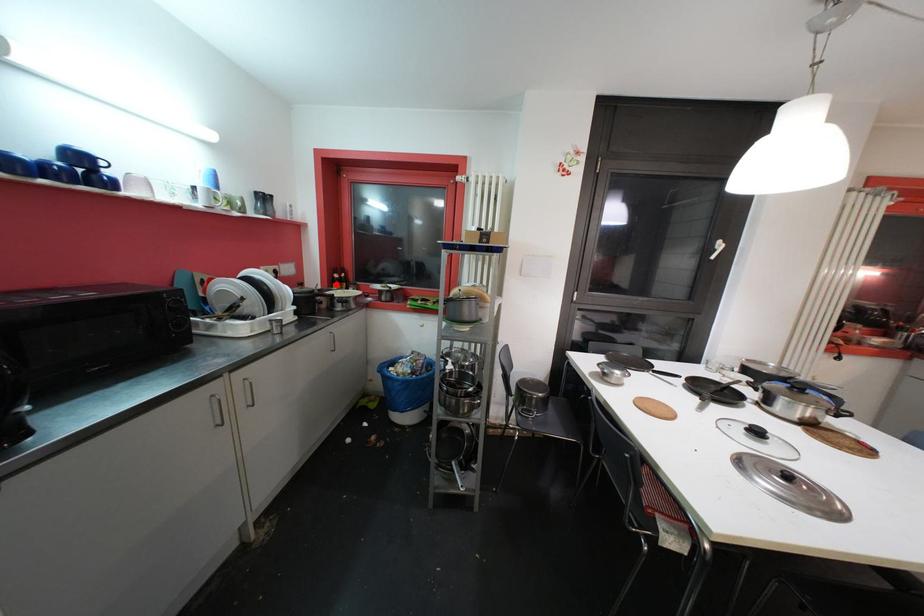
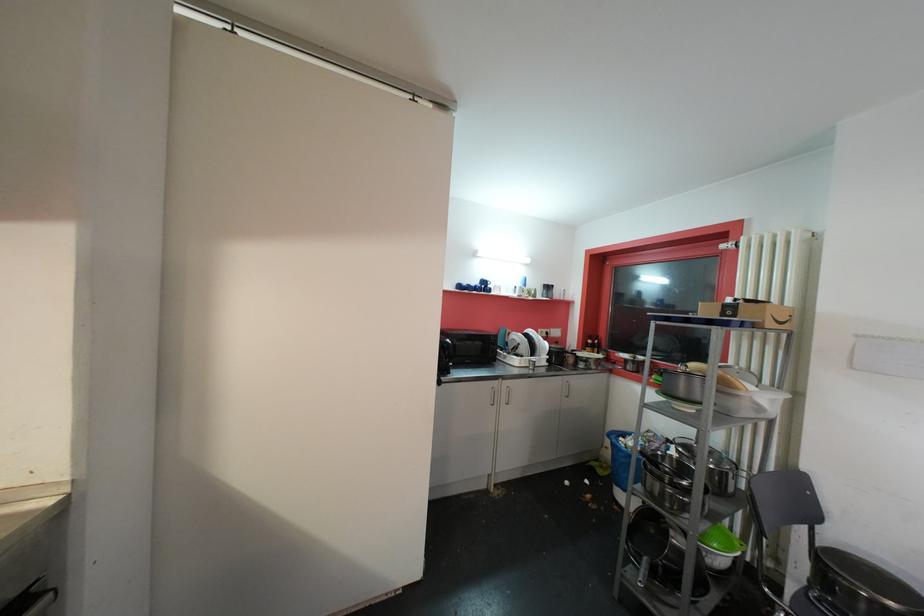
In the second image, find the point that corresponds to the highlighted location in the first image.

(590, 347)